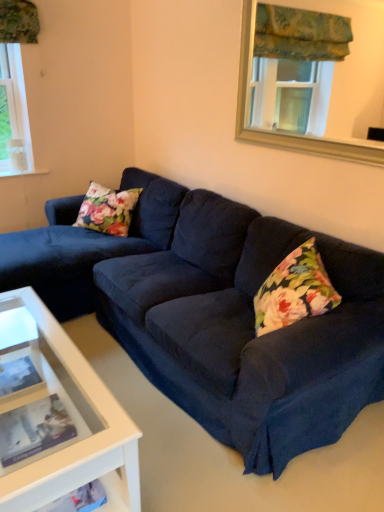
Question: Can you confirm if gold-framed mirror at upper center is taller than suede dark blue couch at center?

Choices:
 (A) yes
 (B) no

Answer: (B)

Question: From the image's perspective, is gold-framed mirror at upper center on suede dark blue couch at center?

Choices:
 (A) no
 (B) yes

Answer: (B)

Question: From the image's perspective, does gold-framed mirror at upper center appear lower than suede dark blue couch at center?

Choices:
 (A) no
 (B) yes

Answer: (A)

Question: Is suede dark blue couch at center inside gold-framed mirror at upper center?

Choices:
 (A) yes
 (B) no

Answer: (B)

Question: Is gold-framed mirror at upper center facing away from suede dark blue couch at center?

Choices:
 (A) yes
 (B) no

Answer: (B)

Question: Are gold-framed mirror at upper center and suede dark blue couch at center far apart?

Choices:
 (A) no
 (B) yes

Answer: (A)

Question: Can you confirm if suede dark blue couch at center is wider than gold-framed mirror at upper center?

Choices:
 (A) yes
 (B) no

Answer: (A)

Question: Does suede dark blue couch at center come in front of gold-framed mirror at upper center?

Choices:
 (A) yes
 (B) no

Answer: (A)

Question: From a real-world perspective, is suede dark blue couch at center under gold-framed mirror at upper center?

Choices:
 (A) no
 (B) yes

Answer: (B)

Question: Can you confirm if suede dark blue couch at center is bigger than gold-framed mirror at upper center?

Choices:
 (A) yes
 (B) no

Answer: (A)

Question: Is suede dark blue couch at center further to the viewer compared to gold-framed mirror at upper center?

Choices:
 (A) no
 (B) yes

Answer: (A)

Question: Is suede dark blue couch at center positioned with its back to gold-framed mirror at upper center?

Choices:
 (A) yes
 (B) no

Answer: (B)

Question: From their relative heights in the image, would you say gold-framed mirror at upper center is taller or shorter than suede dark blue couch at center?

Choices:
 (A) tall
 (B) short

Answer: (B)